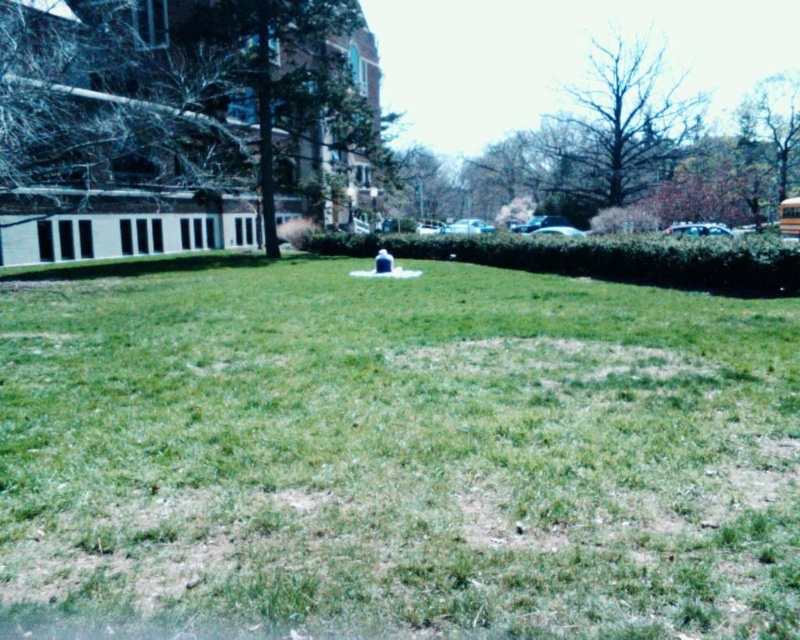
You are standing at the origin point of the coordinate system where the bottom left corner is considered as the origin. The green grassy area is located at coordinates approximately at point 0.706, 0.500. If you want to walk towards the green grassy at center from the origin, in which direction should you move?

To reach the green grassy at center located at coordinates approximately at point (400, 451) from the origin, you should move northeast direction.

You are planning to set up a picnic blanket in the park. The picnic blanket is 2 meters wide. Can the green grassy at center accommodate the blanket without overlapping the yellow matte school bus at right?

The green grassy at center is bigger than the yellow matte school bus at right. Since the grassy area is larger, there should be enough space to place the 2m wide picnic blanket without overlapping the school bus.

You are planning to set up a picnic blanket in the park. The picnic blanket is 2 meters wide. Can the green grassy at center accommodate the width of the picnic blanket? Please consider the yellow matte school bus at right in your answer.

The green grassy at center might be wider than yellow matte school bus at right. Since the school bus is at the right, the grassy area at center could potentially be wide enough for a 2m picnic blanket, but the exact width isn